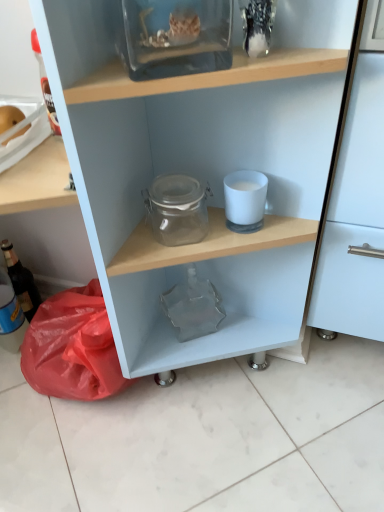
From the picture: What is the approximate width of matte glass bottle at left?

3.78 inches.

Describe the element at coordinates (177, 209) in the screenshot. I see `transparent glass jar at center` at that location.

The image size is (384, 512). Describe the element at coordinates (202, 174) in the screenshot. I see `transparent glass jar at center` at that location.

Identify the location of matte glass bottle at left. (21, 281).

From the image's perspective, is matte glass bottle at left beneath transparent glass jar at center?

Indeed, from the image's perspective, matte glass bottle at left is shown beneath transparent glass jar at center.

Which of these two, matte glass bottle at left or transparent glass jar at center, is bigger?

matte glass bottle at left.

How many degrees apart are the facing directions of transparent glass jar at center and transparent glass jar at upper center?

The facing directions of transparent glass jar at center and transparent glass jar at upper center are 33 degrees apart.

Based on the photo, is transparent glass jar at center aimed at transparent glass jar at upper center?

No, transparent glass jar at center does not turn towards transparent glass jar at upper center.

The image size is (384, 512). I want to click on glass box behind the transparent glass jar at center, so click(177, 37).

From their relative heights in the image, would you say transparent glass jar at center is taller or shorter than transparent glass jar at upper center?

Clearly, transparent glass jar at center is taller compared to transparent glass jar at upper center.

Based on their sizes in the image, would you say matte glass bottle at left is bigger or smaller than transparent glass jar at center?

Considering their sizes, matte glass bottle at left takes up less space than transparent glass jar at center.

Is matte glass bottle at left oriented towards transparent glass jar at center?

Yes, matte glass bottle at left is oriented towards transparent glass jar at center.

Between matte glass bottle at left and transparent glass jar at center, which one has larger width?

transparent glass jar at center.

Do you think matte glass bottle at left is within transparent glass jar at center, or outside of it?

matte glass bottle at left is spatially positioned inside transparent glass jar at center.

Does point (164, 45) come farther from viewer compared to point (27, 304)?

No, (164, 45) is in front of (27, 304).

Identify the location of glass box that is on the right side of matte glass bottle at left. Image resolution: width=384 pixels, height=512 pixels. (177, 37).

In the image, is transparent glass jar at upper center positioned in front of or behind matte glass bottle at left?

transparent glass jar at upper center is positioned closer to the viewer than matte glass bottle at left.

Who is bigger, transparent glass jar at center or transparent glass jar at center?

transparent glass jar at center is bigger.

Is transparent glass jar at center to the left of transparent glass jar at center from the viewer's perspective?

Incorrect, transparent glass jar at center is not on the left side of transparent glass jar at center.

Considering the relative sizes of transparent glass jar at center and transparent glass jar at center in the image provided, is transparent glass jar at center taller than transparent glass jar at center?

No, transparent glass jar at center is not taller than transparent glass jar at center.

The image size is (384, 512). In order to click on glass jar on the right of transparent glass jar at center in this screenshot , I will do `click(177, 209)`.

Which of these two, transparent glass jar at center or transparent glass jar at center, stands taller?

Standing taller between the two is transparent glass jar at center.

Is transparent glass jar at center located within transparent glass jar at center?

Yes, transparent glass jar at center contains transparent glass jar at center.

From the image's perspective, which one is positioned lower, transparent glass jar at center or transparent glass jar at center?

transparent glass jar at center appears lower in the image.

How different are the orientations of transparent glass jar at center and transparent glass jar at center in degrees?

They differ by 36 degrees in their facing directions.

From the image's perspective, which one is positioned lower, transparent glass jar at center or matte glass bottle at left?

From the image's view, matte glass bottle at left is below.

Is transparent glass jar at center turned away from matte glass bottle at left?

Correct, transparent glass jar at center is looking away from matte glass bottle at left.

Considering the positions of objects transparent glass jar at center and matte glass bottle at left in the image provided, who is more to the left, transparent glass jar at center or matte glass bottle at left?

matte glass bottle at left.

At what (x,y) coordinates should I click in order to perform the action: click on bottle below the transparent glass jar at center (from the image's perspective). Please return your answer as a coordinate pair (x, y). The width and height of the screenshot is (384, 512). Looking at the image, I should click on (21, 281).

What are the coordinates of `glass jar on the right of matte glass bottle at left` in the screenshot? It's located at (177, 209).

Image resolution: width=384 pixels, height=512 pixels. In the image, there is a transparent glass jar at upper center. Find the location of `shelf below it (from the image's perspective)`. shelf below it (from the image's perspective) is located at coordinates (202, 174).

Looking at the image, which one is located further to matte glass bottle at left, transparent glass jar at upper center or transparent glass jar at center?

transparent glass jar at upper center lies further to matte glass bottle at left than the other object.

Estimate the real-world distances between objects in this image. Which object is further from transparent glass jar at center, transparent glass jar at center or transparent glass jar at upper center?

The object further to transparent glass jar at center is transparent glass jar at upper center.

Based on their spatial positions, is transparent glass jar at center or matte glass bottle at left closer to transparent glass jar at center?

transparent glass jar at center.

Based on their spatial positions, is transparent glass jar at center or matte glass bottle at left closer to transparent glass jar at upper center?

transparent glass jar at center is positioned closer to the anchor transparent glass jar at upper center.

When comparing their distances from transparent glass jar at center, does matte glass bottle at left or transparent glass jar at center seem further?

matte glass bottle at left.

Considering their positions, is transparent glass jar at upper center positioned closer to transparent glass jar at center than matte glass bottle at left?

transparent glass jar at upper center.

Estimate the real-world distances between objects in this image. Which object is further from matte glass bottle at left, transparent glass jar at center or transparent glass jar at center?

The object further to matte glass bottle at left is transparent glass jar at center.

When comparing their distances from transparent glass jar at center, does matte glass bottle at left or transparent glass jar at center seem further?

The object further to transparent glass jar at center is matte glass bottle at left.

Locate an element on the screen. glass jar situated between matte glass bottle at left and transparent glass jar at upper center from left to right is located at coordinates (177, 209).

Identify the location of glass box between transparent glass jar at center and transparent glass jar at center from front to back. Image resolution: width=384 pixels, height=512 pixels. (177, 37).

Where is `glass jar located between transparent glass jar at center and matte glass bottle at left in the depth direction`? The width and height of the screenshot is (384, 512). glass jar located between transparent glass jar at center and matte glass bottle at left in the depth direction is located at coordinates (177, 209).

The image size is (384, 512). What are the coordinates of `glass box between transparent glass jar at center and matte glass bottle at left from front to back` in the screenshot? It's located at (177, 37).